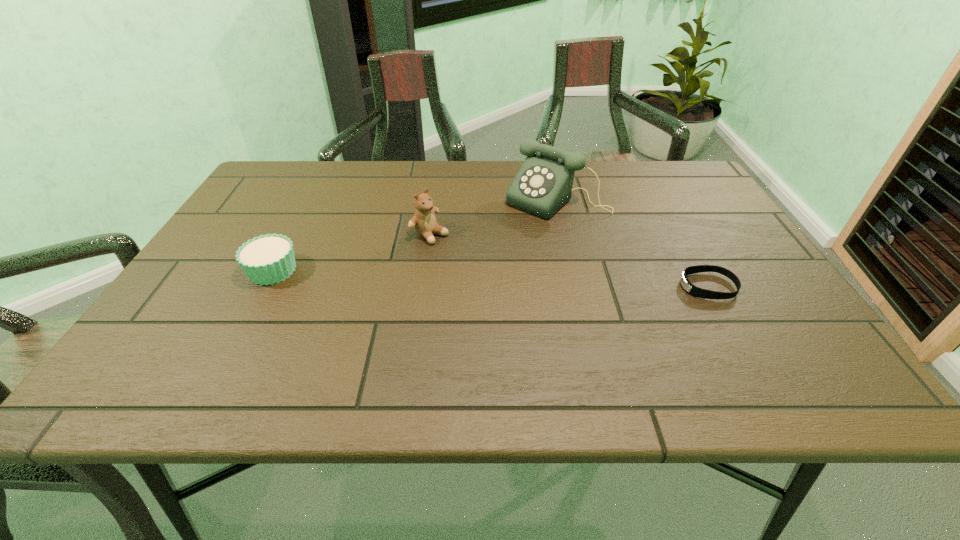
The width and height of the screenshot is (960, 540). I want to click on the second shortest object, so click(x=268, y=259).

You are a GUI agent. You are given a task and a screenshot of the screen. Output one action in this format:
    pyautogui.click(x=<x>, y=<y>)
    Task: Click on the leftmost object
    
    Given the screenshot: What is the action you would take?
    pyautogui.click(x=268, y=259)

Where is `the shortest object`? The image size is (960, 540). the shortest object is located at coordinates (691, 289).

Identify the location of wristband. (691, 289).

Identify the location of the second tallest object. (424, 222).

Find the location of a particular element. The image size is (960, 540). the third object from right to left is located at coordinates (424, 222).

Find the location of `the tallest object`. the tallest object is located at coordinates (543, 184).

At what (x,y) coordinates should I click in order to perform the action: click on the farthest object. Please return your answer as a coordinate pair (x, y). Looking at the image, I should click on (543, 184).

This screenshot has width=960, height=540. Find the location of `vacant position located on the right of the leftmost object`. vacant position located on the right of the leftmost object is located at coordinates (399, 270).

Locate an element on the screen. The height and width of the screenshot is (540, 960). vacant space located on the display of the wristband is located at coordinates (658, 286).